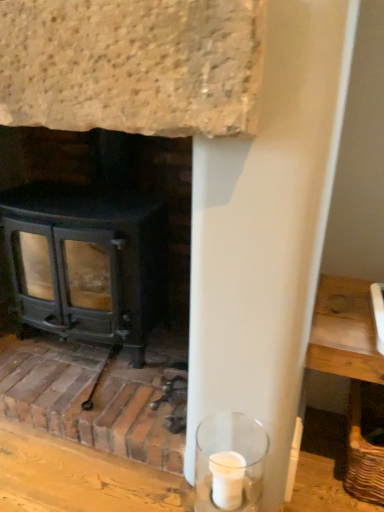
Where is `matte black wood burning stove at left`? The width and height of the screenshot is (384, 512). matte black wood burning stove at left is located at coordinates (88, 262).

Describe the element at coordinates (88, 262) in the screenshot. The image size is (384, 512). I see `matte black wood burning stove at left` at that location.

This screenshot has height=512, width=384. In order to click on matte black wood burning stove at left in this screenshot , I will do `click(88, 262)`.